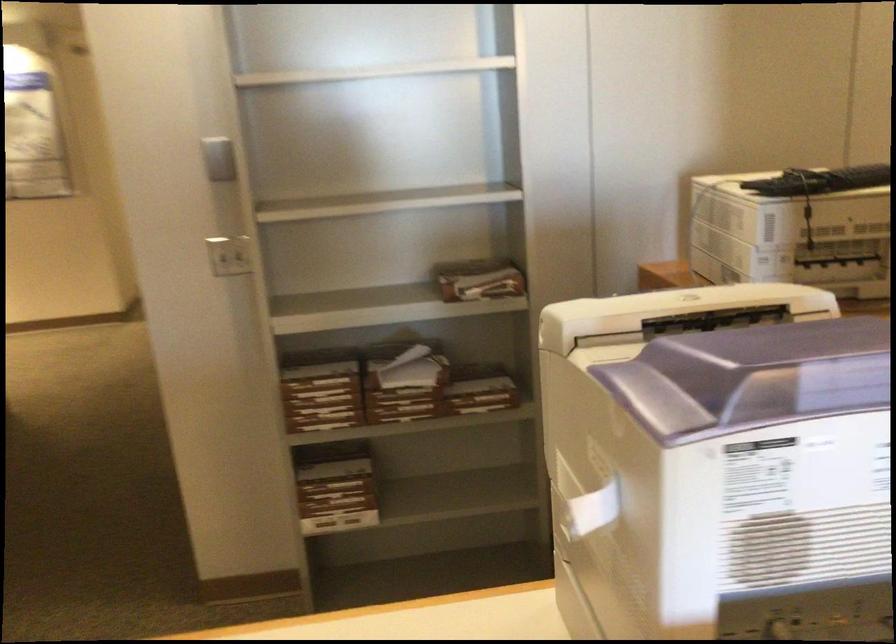
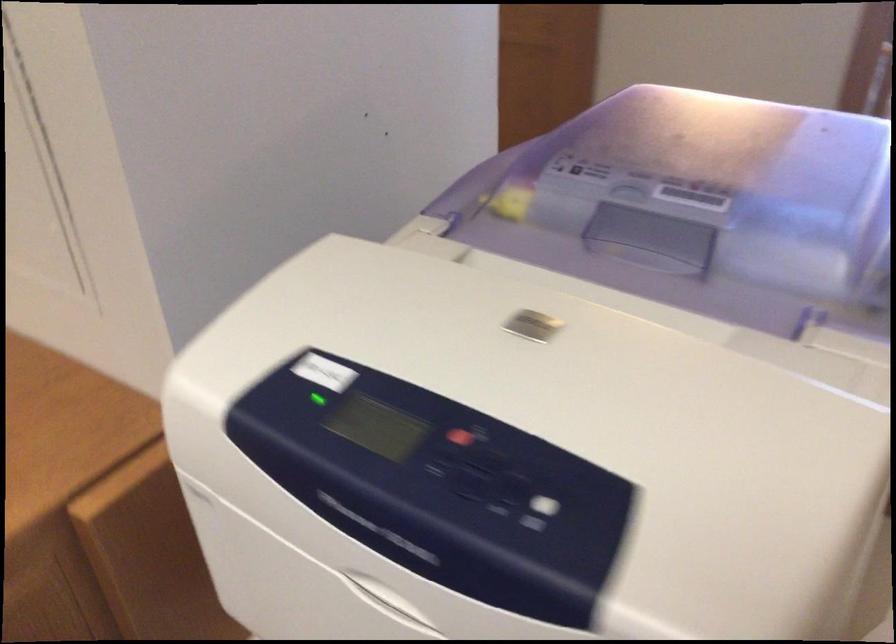
In the second image, find the point that corresponds to [618,301] in the first image.

(538, 512)